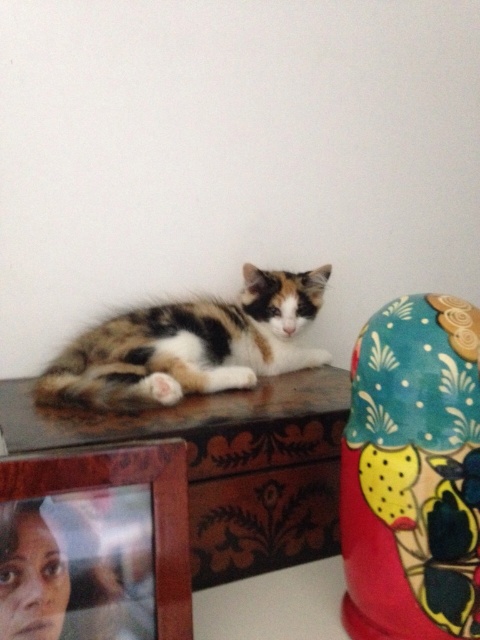
Can you confirm if wooden carved table at center is smaller than calico fur cat at center?

No, wooden carved table at center is not smaller than calico fur cat at center.

Identify the location of wooden carved table at center. The height and width of the screenshot is (640, 480). (228, 465).

You are a GUI agent. You are given a task and a screenshot of the screen. Output one action in this format:
    pyautogui.click(x=<x>, y=<y>)
    Task: Click on the wooden carved table at center
    
    Given the screenshot: What is the action you would take?
    pyautogui.click(x=228, y=465)